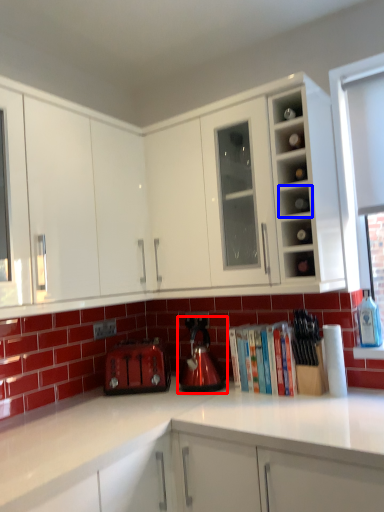
Question: Which object appears farthest to the camera in this image, kitchen appliance (highlighted by a red box) or shelf (highlighted by a blue box)?

Choices:
 (A) kitchen appliance
 (B) shelf

Answer: (A)